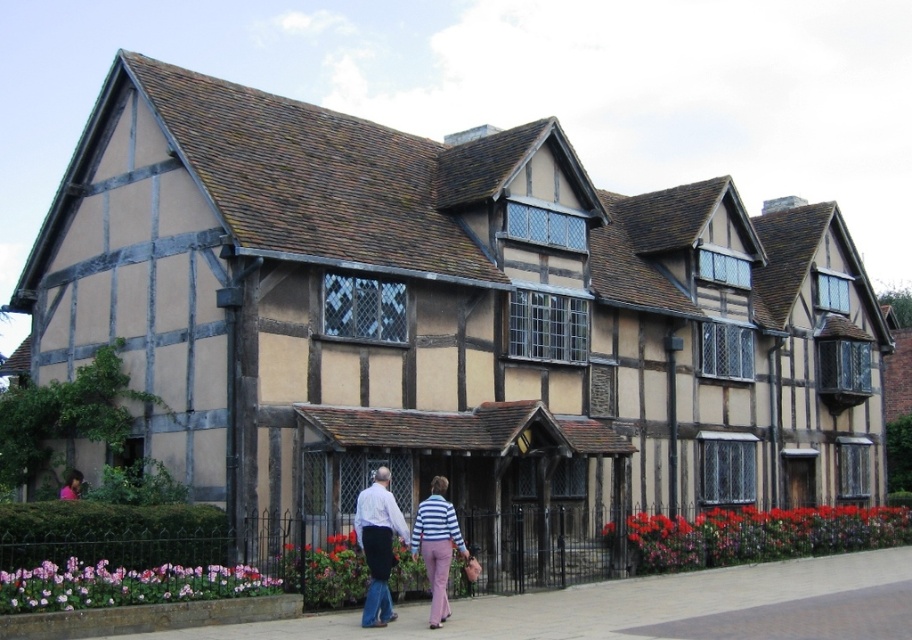
You are standing in front of the traditional half timbered house and see a striped cotton sweater at center and a striped fabric pants at center. Which item is closer to you?

The striped cotton sweater at center is closer to you because it is in front of the striped fabric pants at center.

You are standing in front of a traditional half timbered house and see a person wearing a light blue shirt at center and striped fabric pants at center. Which piece of clothing is bigger?

The light blue shirt at center is larger in size than the striped fabric pants at center.

You are trying to decide which clothing item to wear for a casual day out. You have a striped cotton sweater at center and a light blue shirt at center. Which one is more suitable for a cooler day?

The striped cotton sweater at center is smaller than the light blue shirt at center, so the light blue shirt at center might be more suitable for a cooler day since it can provide better coverage and warmth.